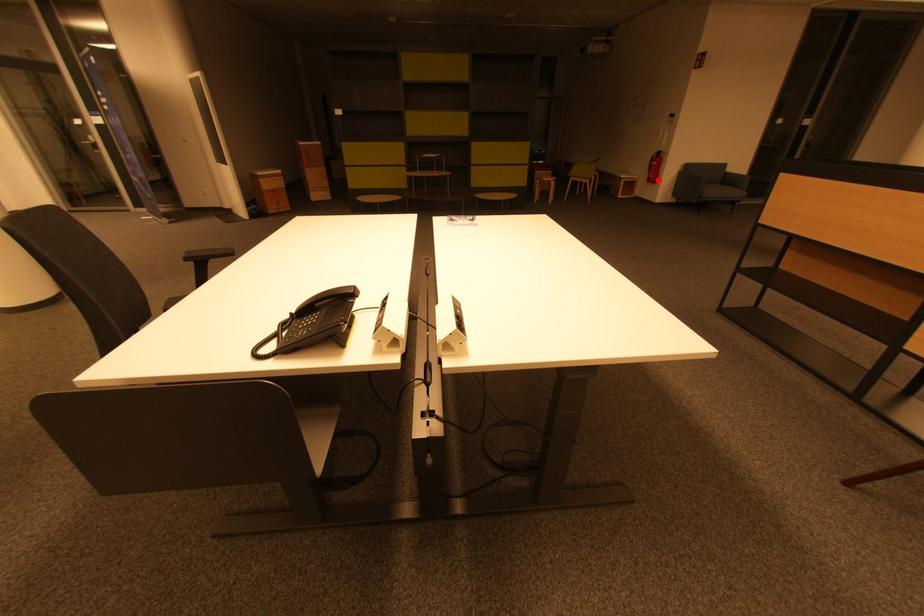
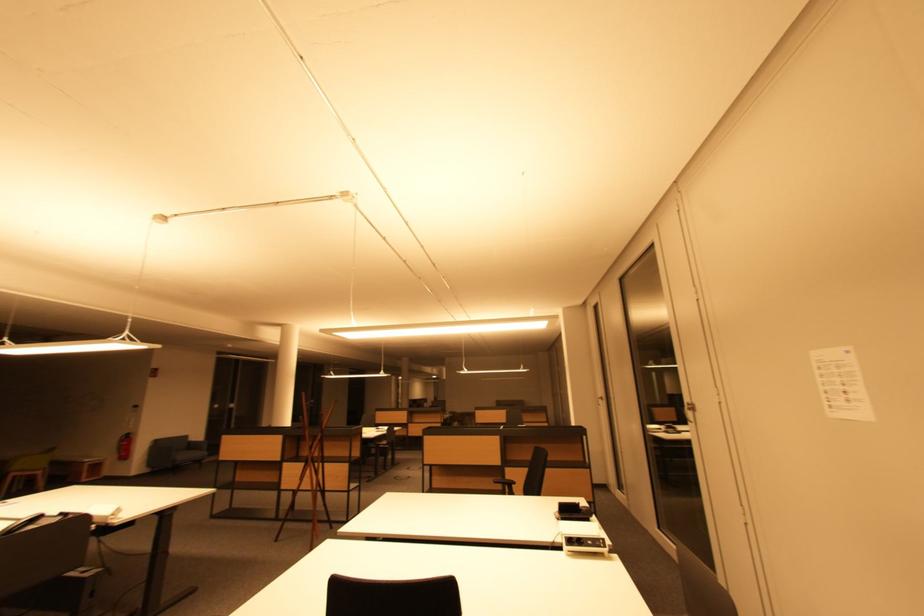
Question: I am providing you with two images of the same scene from different viewpoints. Image1 has a red point marked. In image2, the corresponding 3D location appears at what relative position? Reply with the corresponding letter.

Choices:
 (A) Closer
 (B) Farther

Answer: (B)